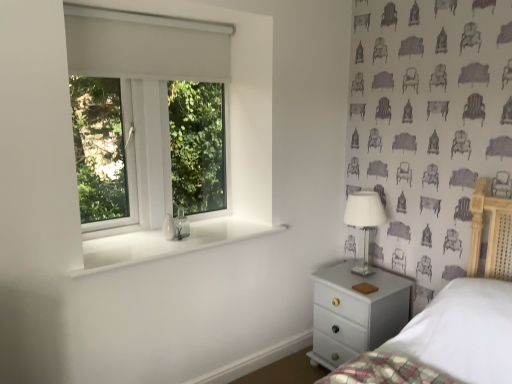
Question: Considering the relative sizes of white glossy window sill at lower left and white plastic window at upper left in the image provided, is white glossy window sill at lower left thinner than white plastic window at upper left?

Choices:
 (A) no
 (B) yes

Answer: (A)

Question: Is white glossy window sill at lower left facing away from white plastic window at upper left?

Choices:
 (A) yes
 (B) no

Answer: (B)

Question: Considering the relative sizes of white glossy window sill at lower left and white plastic window at upper left in the image provided, is white glossy window sill at lower left bigger than white plastic window at upper left?

Choices:
 (A) no
 (B) yes

Answer: (A)

Question: Can you confirm if white glossy window sill at lower left is wider than white plastic window at upper left?

Choices:
 (A) yes
 (B) no

Answer: (A)

Question: Is white glossy window sill at lower left smaller than white plastic window at upper left?

Choices:
 (A) no
 (B) yes

Answer: (B)

Question: From the image's perspective, is white glossy window sill at lower left above white plastic window at upper left?

Choices:
 (A) yes
 (B) no

Answer: (B)

Question: Are white glossy chest of drawers at lower right and white glass table lamp at right beside each other?

Choices:
 (A) no
 (B) yes

Answer: (A)

Question: Is white glossy chest of drawers at lower right in front of white glass table lamp at right?

Choices:
 (A) yes
 (B) no

Answer: (A)

Question: Is white glossy chest of drawers at lower right turned away from white glass table lamp at right?

Choices:
 (A) yes
 (B) no

Answer: (B)

Question: From a real-world perspective, is white glossy chest of drawers at lower right physically below white glass table lamp at right?

Choices:
 (A) yes
 (B) no

Answer: (A)

Question: From the image's perspective, is white glossy chest of drawers at lower right beneath white glass table lamp at right?

Choices:
 (A) no
 (B) yes

Answer: (B)

Question: Does white glossy chest of drawers at lower right lie behind white glass table lamp at right?

Choices:
 (A) no
 (B) yes

Answer: (A)

Question: From the image's perspective, is white glossy chest of drawers at lower right under white plastic window at upper left?

Choices:
 (A) no
 (B) yes

Answer: (B)